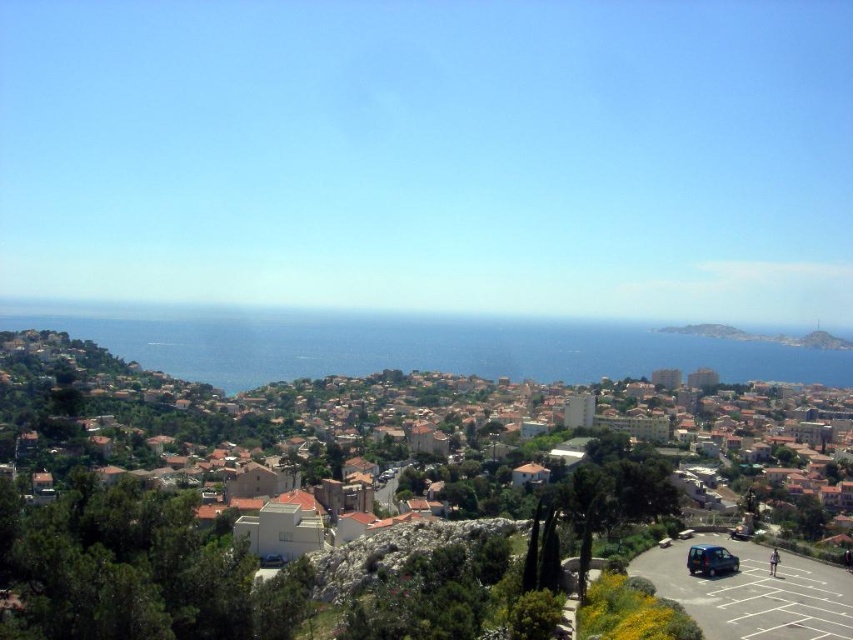
Question: Which object is positioned closest to the blue water at center?

Choices:
 (A) metallic blue van at lower right
 (B) orange tiled roofs at center

Answer: (B)

Question: Is blue water at center bigger than metallic blue van at lower right?

Choices:
 (A) no
 (B) yes

Answer: (B)

Question: Is blue water at center thinner than metallic blue van at lower right?

Choices:
 (A) no
 (B) yes

Answer: (A)

Question: Which object is closer to the camera taking this photo?

Choices:
 (A) blue water at center
 (B) metallic blue van at lower right

Answer: (B)

Question: Does orange tiled roofs at center appear over blue water at center?

Choices:
 (A) yes
 (B) no

Answer: (B)

Question: Which point is farther from the camera taking this photo?

Choices:
 (A) (379, 339)
 (B) (793, 454)
 (C) (711, 556)

Answer: (A)